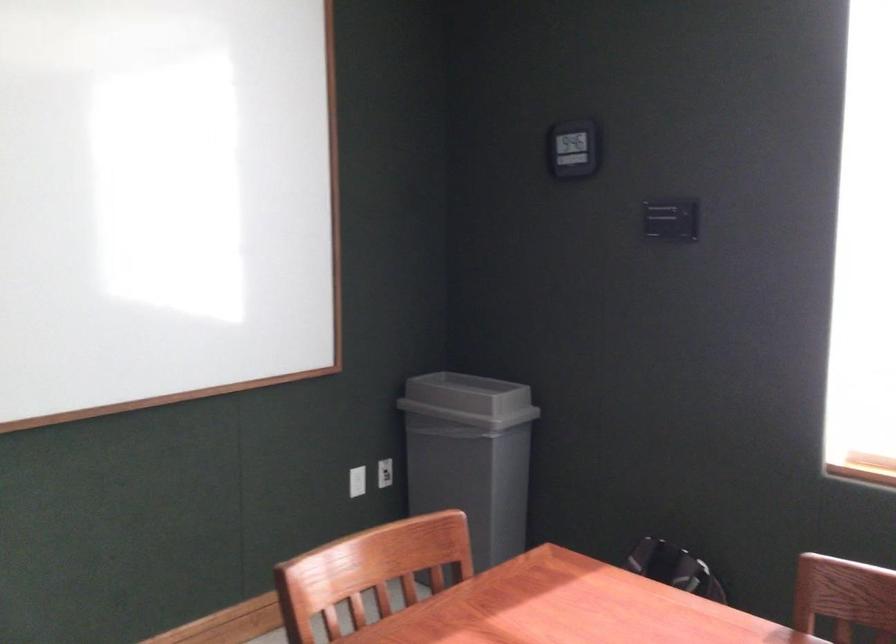
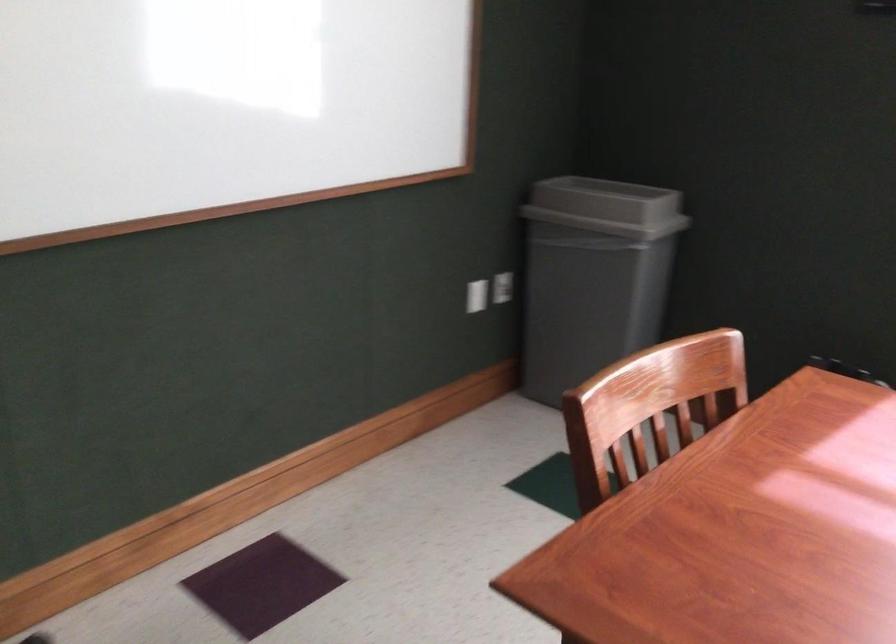
In the second image, find the point that corresponds to point 386,474 in the first image.

(503, 287)